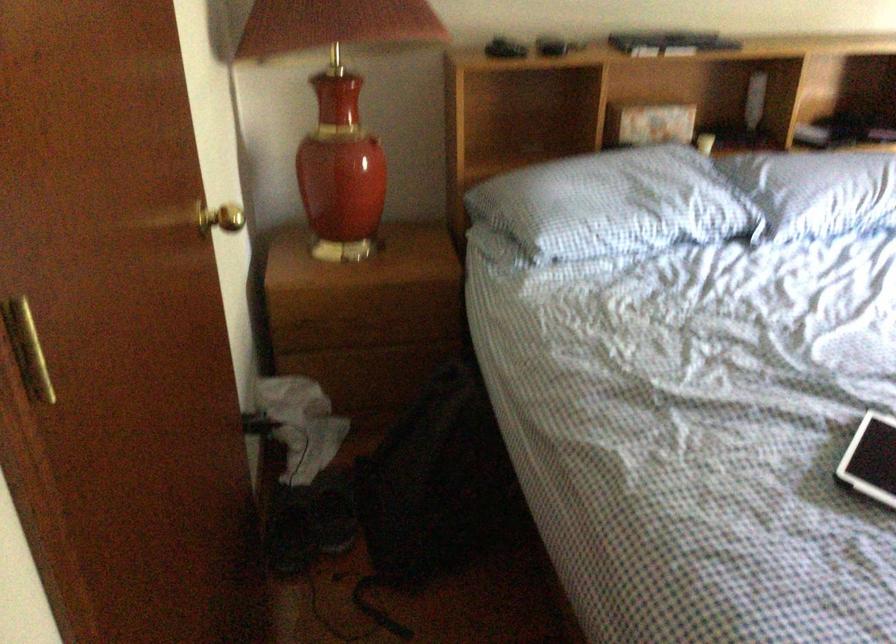
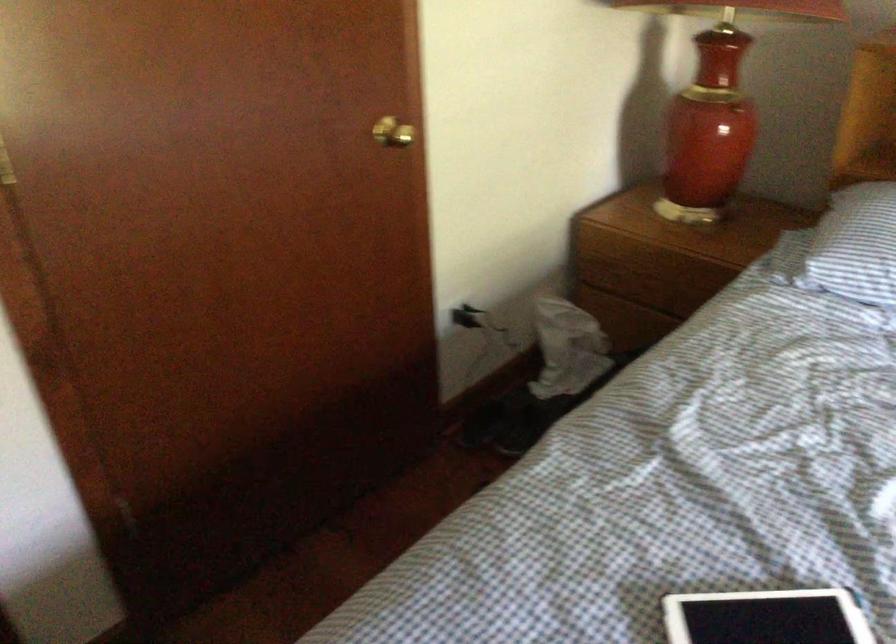
Find the pixel in the second image that matches [366,325] in the first image.

(650, 283)